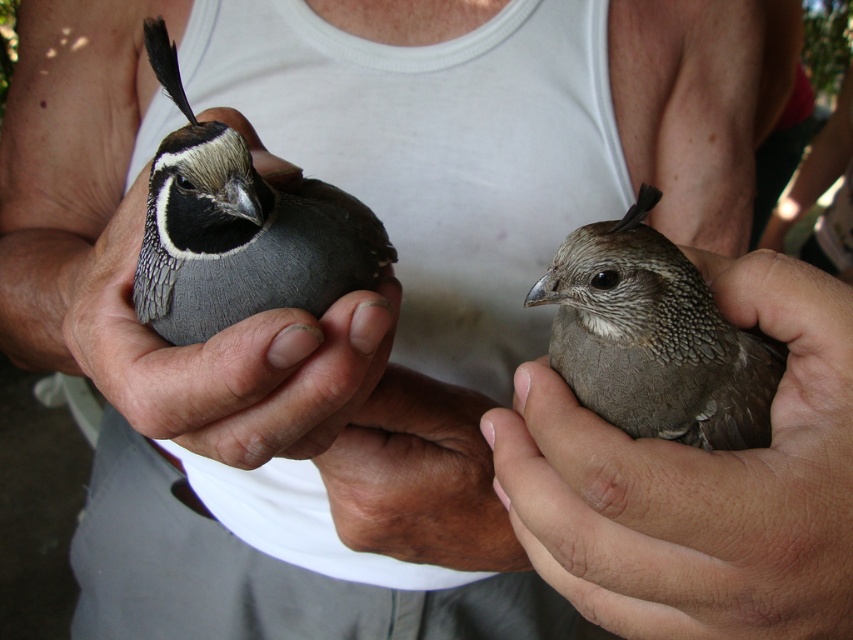
Question: Which object is farther from the camera taking this photo?

Choices:
 (A) matte gray bird at left
 (B) gray speckled bird at right
 (C) brown feathered bird at center

Answer: (B)

Question: Can you confirm if brown feathered bird at center is positioned below brown skin at center?

Choices:
 (A) yes
 (B) no

Answer: (B)

Question: Does gray speckled bird at right have a lesser width compared to gray speckled feather at left?

Choices:
 (A) no
 (B) yes

Answer: (A)

Question: Which object appears farthest from the camera in this image?

Choices:
 (A) brown skin at center
 (B) brown feathered bird at center
 (C) matte gray bird at left

Answer: (A)

Question: Is brown feathered bird at center below brown skin at center?

Choices:
 (A) yes
 (B) no

Answer: (B)

Question: Which is farther from the brown skin at center?

Choices:
 (A) matte gray bird at left
 (B) gray speckled bird at right
 (C) gray speckled feather at left
 (D) brown feathered bird at center

Answer: (B)